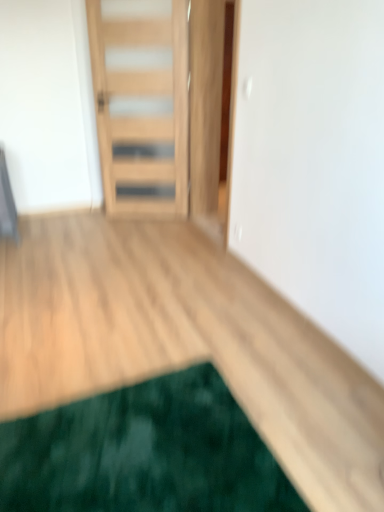
Question: Is natural wood door at center positioned far away from green plush mat at lower left?

Choices:
 (A) no
 (B) yes

Answer: (B)

Question: Is natural wood door at center smaller than green plush mat at lower left?

Choices:
 (A) yes
 (B) no

Answer: (B)

Question: Is natural wood door at center next to green plush mat at lower left?

Choices:
 (A) yes
 (B) no

Answer: (B)

Question: Would you say green plush mat at lower left is part of natural wood door at center's contents?

Choices:
 (A) no
 (B) yes

Answer: (A)

Question: Can we say natural wood door at center lies outside green plush mat at lower left?

Choices:
 (A) no
 (B) yes

Answer: (B)

Question: Is natural wood door at center aimed at green plush mat at lower left?

Choices:
 (A) no
 (B) yes

Answer: (B)

Question: Does green plush mat at lower left have a lesser height compared to natural wood door at center?

Choices:
 (A) no
 (B) yes

Answer: (B)

Question: Does green plush mat at lower left have a smaller size compared to natural wood door at center?

Choices:
 (A) yes
 (B) no

Answer: (A)

Question: From the image's perspective, would you say green plush mat at lower left is positioned over natural wood door at center?

Choices:
 (A) no
 (B) yes

Answer: (A)

Question: Is green plush mat at lower left surrounding natural wood door at center?

Choices:
 (A) yes
 (B) no

Answer: (B)

Question: Does green plush mat at lower left have a greater height compared to natural wood door at center?

Choices:
 (A) yes
 (B) no

Answer: (B)

Question: From the image's perspective, is green plush mat at lower left below natural wood door at center?

Choices:
 (A) no
 (B) yes

Answer: (B)

Question: In terms of height, does green plush mat at lower left look taller or shorter compared to natural wood door at center?

Choices:
 (A) short
 (B) tall

Answer: (A)